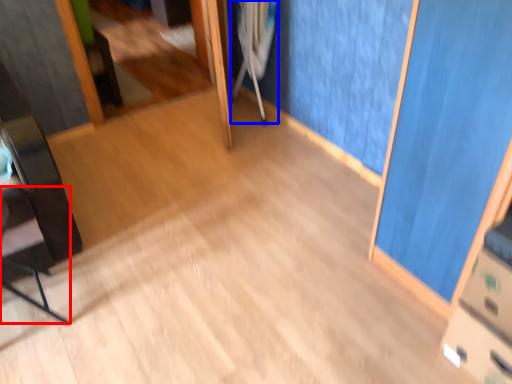
Question: Which of the following is the farthest to the observer, chair (highlighted by a red box) or crutch (highlighted by a blue box)?

Choices:
 (A) chair
 (B) crutch

Answer: (B)